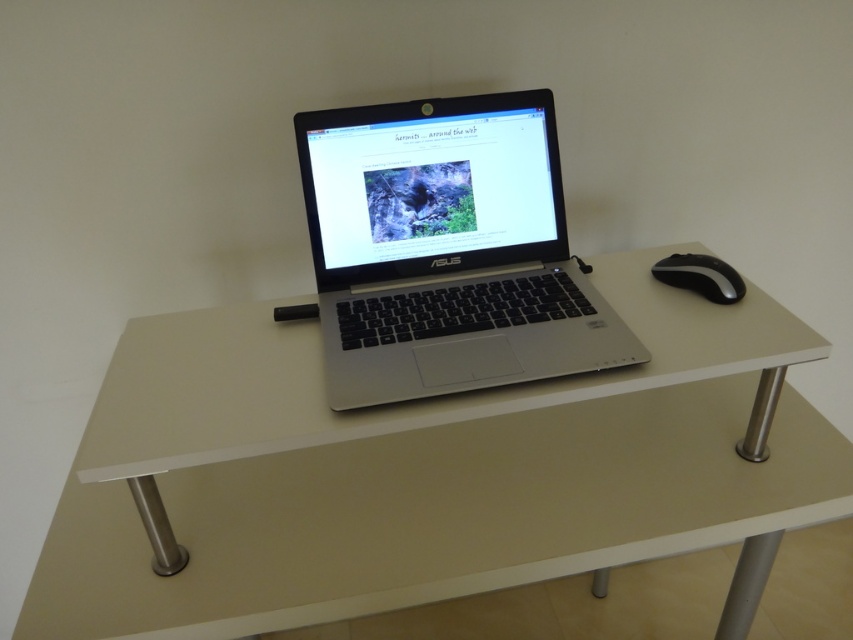
You are a delivery person who just arrived at the office. You need to place a new mouse on the desk. The mouse is 10 cm in length. The space between the silver metallic laptop at center and the edge of the white glossy table at center is 15 cm. Can you fit the mouse there?

The space between the silver metallic laptop at center and the edge of the white glossy table at center is 15 cm, which is wider than the mouse length of 10 cm. Yes, the mouse can fit there.

You are setting up a new monitor stand that requires at least 10 cm of vertical space between the top of the silver metallic laptop at center and the bottom of the black rubberized mouse at right. Can the stand fit in this space?

The silver metallic laptop at center is much taller than the black rubberized mouse at right, so there is insufficient vertical space between them to fit the monitor stand requiring 10 cm.

You are standing in front of the minimalist workspace setup. There is a point at coordinates point (x=190, y=518). Can you reach this point without moving your hand more than 40 inches from your current position?

The point (x=190, y=518) is 38.57 inches away from the camera, so yes, you can reach it without moving your hand more than 40 inches from your current position.